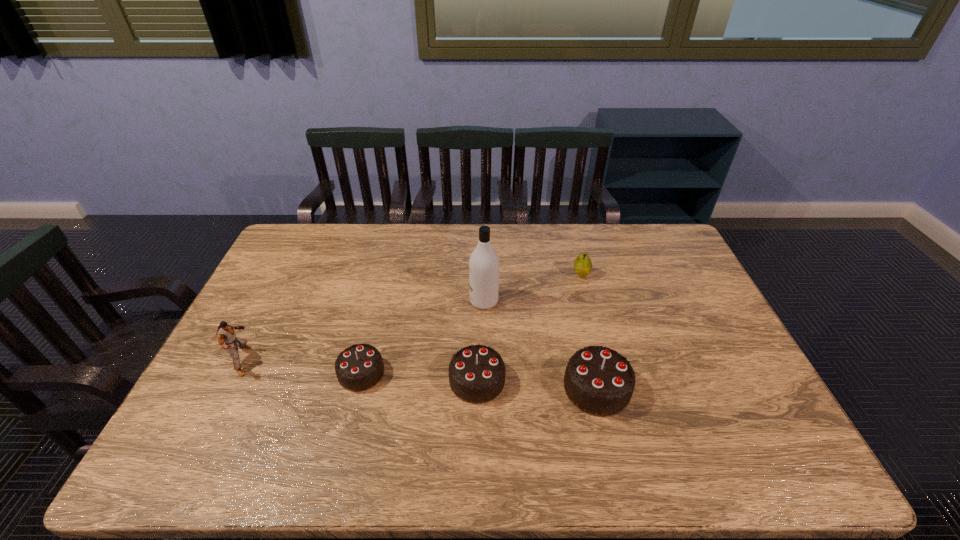
Find the location of a particular element. free space located on the left of the rightmost chocolate cake is located at coordinates (460, 388).

Identify the location of vacant space located 0.080m on the front-facing side of the puncher. (283, 360).

At what (x,y) coordinates should I click in order to perform the action: click on free location located on the front of the pear. Please return your answer as a coordinate pair (x, y). The image size is (960, 540). Looking at the image, I should click on (588, 303).

Find the location of a particular element. The height and width of the screenshot is (540, 960). free location located 0.100m on the front-facing side of the fifth nearest object is located at coordinates (438, 301).

At what (x,y) coordinates should I click in order to perform the action: click on vacant region located on the front-facing side of the fifth nearest object. Please return your answer as a coordinate pair (x, y). The height and width of the screenshot is (540, 960). Looking at the image, I should click on (353, 301).

Where is `blank space located on the front-facing side of the fifth nearest object`? blank space located on the front-facing side of the fifth nearest object is located at coordinates (397, 301).

Locate an element on the screen. This screenshot has width=960, height=540. object located at the left edge is located at coordinates (225, 333).

Locate an element on the screen. vacant space at the far edge of the desktop is located at coordinates (396, 249).

Where is `vacant space at the near edge of the desktop`? The height and width of the screenshot is (540, 960). vacant space at the near edge of the desktop is located at coordinates (622, 427).

Where is `vacant space at the right edge of the desktop`? Image resolution: width=960 pixels, height=540 pixels. vacant space at the right edge of the desktop is located at coordinates (691, 268).